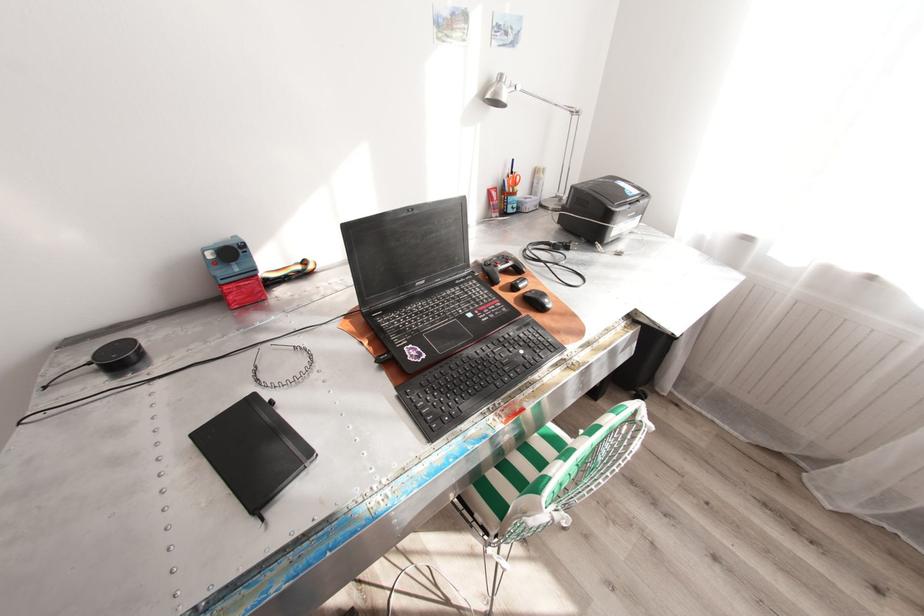
The image size is (924, 616). Describe the element at coordinates (500, 92) in the screenshot. I see `the silver lamp head` at that location.